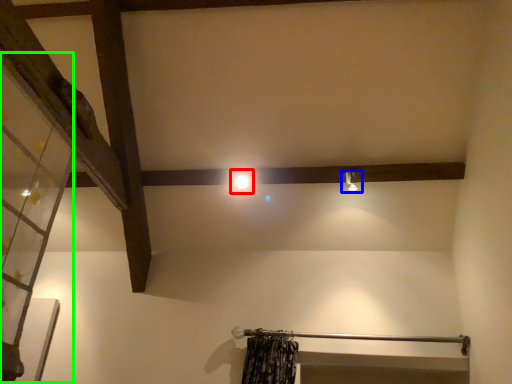
Question: Based on their relative distances, which object is farther from light (highlighted by a red box)? Choose from light fixture (highlighted by a blue box) and glass door (highlighted by a green box).

Choices:
 (A) light fixture
 (B) glass door

Answer: (B)